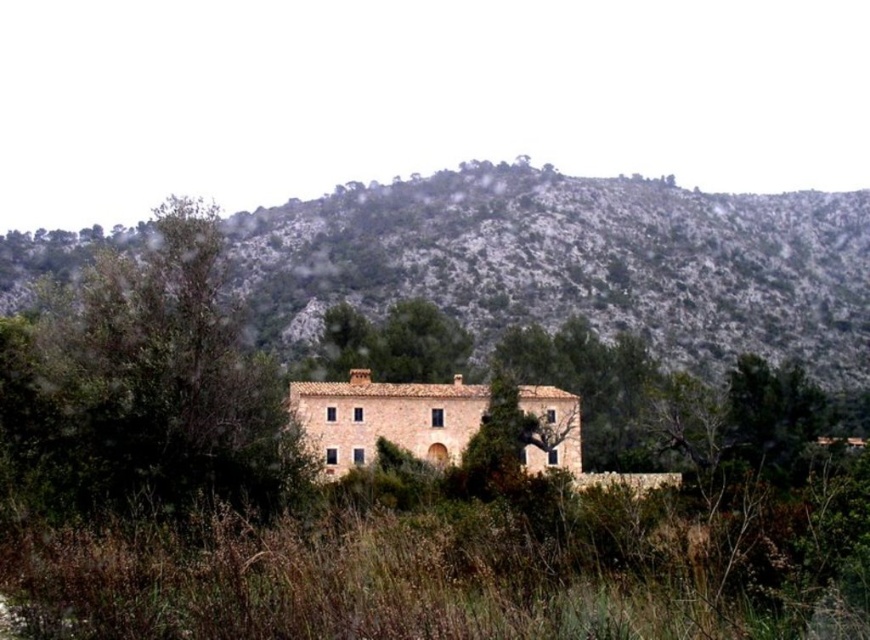
Is green mossy hillside at center wider than green leafy tree at center?

Correct, the width of green mossy hillside at center exceeds that of green leafy tree at center.

Between point (851, 310) and point (178, 298), which one is positioned in front?

Point (178, 298)

Does point (432, 241) come closer to viewer compared to point (312, 472)?

No, it is behind (312, 472).

This screenshot has height=640, width=870. Identify the location of green mossy hillside at center. (574, 262).